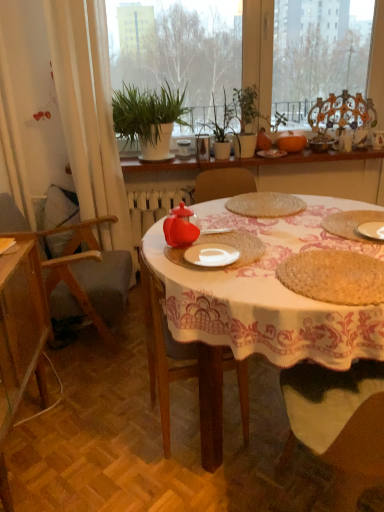
Locate an element on the screen. This screenshot has width=384, height=512. free space to the left of white ceramic plate at center is located at coordinates (168, 261).